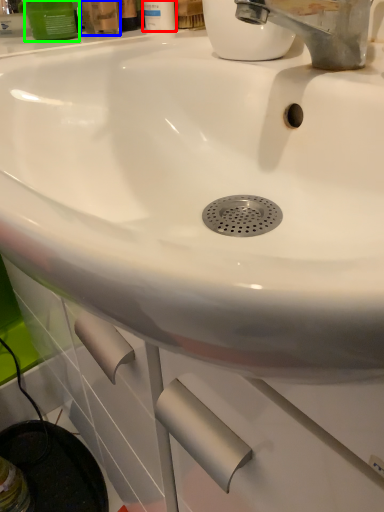
Question: Considering the real-world distances, which object is farthest from mouthwash (highlighted by a red box)? mouthwash (highlighted by a blue box) or mouthwash (highlighted by a green box)?

Choices:
 (A) mouthwash
 (B) mouthwash

Answer: (B)